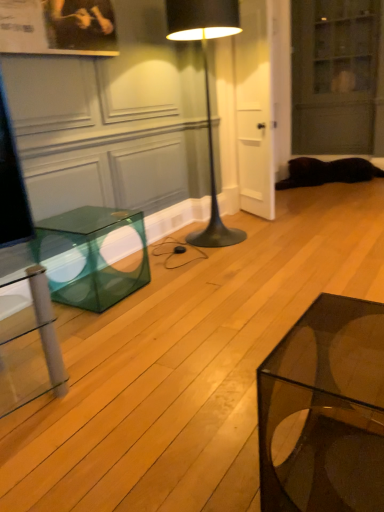
Where is `vacant space to the right of transparent glass cube at left`? The height and width of the screenshot is (512, 384). vacant space to the right of transparent glass cube at left is located at coordinates (183, 298).